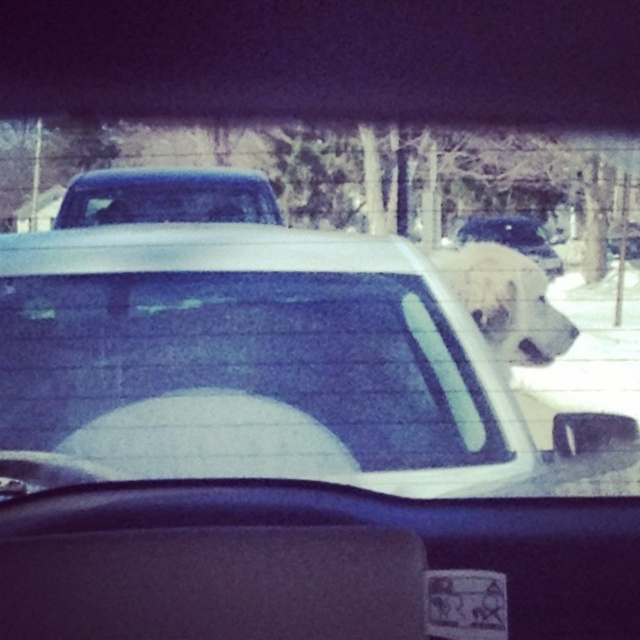
Question: Which of the following is the closest to the observer?

Choices:
 (A) white plastic license plate at center
 (B) transparent glass window at center
 (C) white matte dog at upper right

Answer: (A)

Question: Which of the following is the farthest from the observer?

Choices:
 (A) white plastic license plate at center
 (B) transparent glass window at center
 (C) white matte dog at upper right

Answer: (C)

Question: Can you confirm if transparent glass window at center is positioned above clear glass window at upper center?

Choices:
 (A) yes
 (B) no

Answer: (B)

Question: Does white fluffy dog at upper right come in front of clear glass window at upper center?

Choices:
 (A) no
 (B) yes

Answer: (B)

Question: Is the position of transparent glass window at center less distant than that of white fluffy dog at upper right?

Choices:
 (A) no
 (B) yes

Answer: (B)

Question: Which point is closer to the camera?

Choices:
 (A) white matte dog at upper right
 (B) clear glass window at upper center
 (C) transparent glass window at center

Answer: (C)